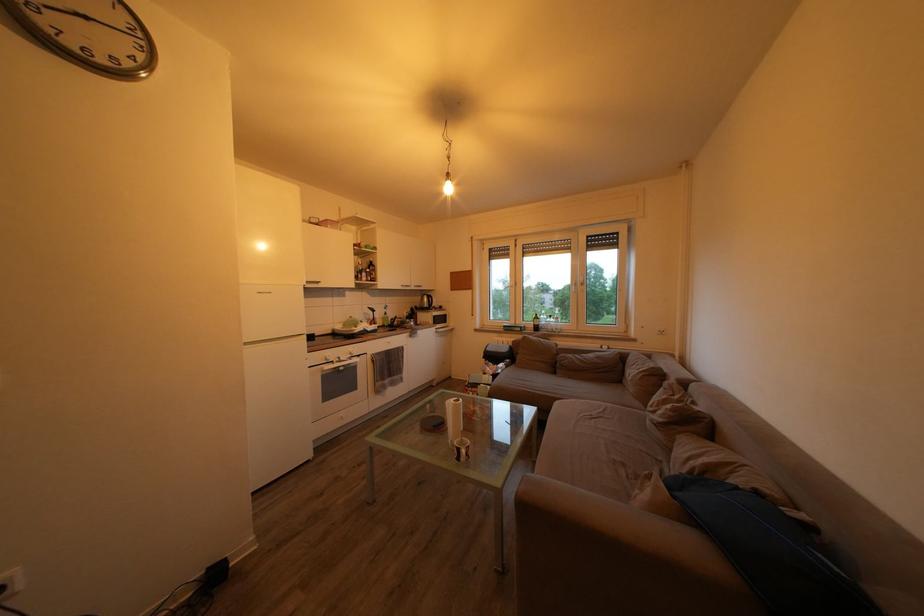
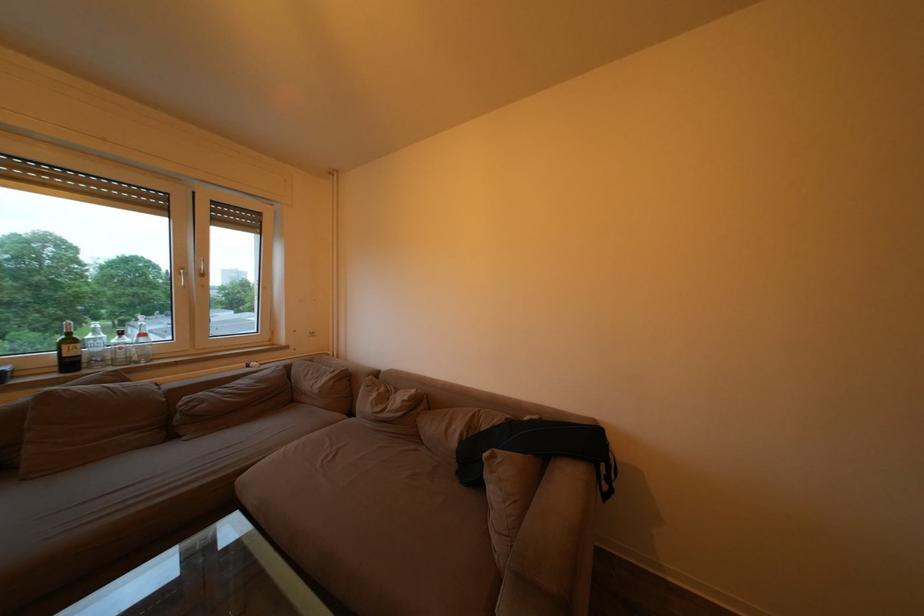
Where in the second image is the point corresponding to point 563,379 from the first image?

(178, 443)